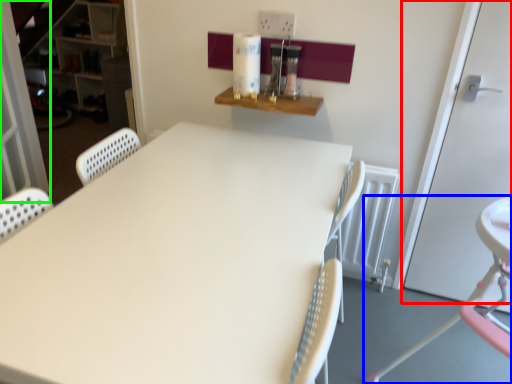
Question: Estimate the real-world distances between objects in this image. Which object is closer to door (highlighted by a red box), chair (highlighted by a blue box) or screen door (highlighted by a green box)?

Choices:
 (A) chair
 (B) screen door

Answer: (A)